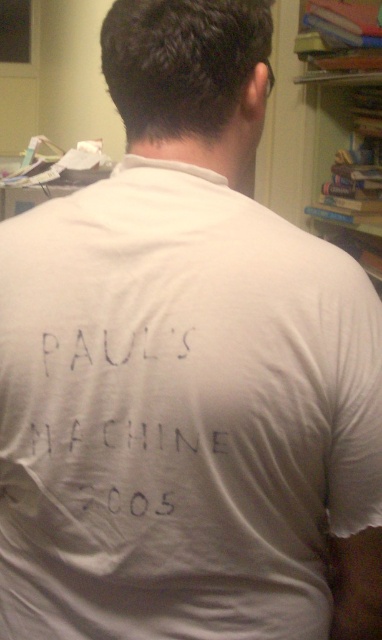
Between white fabric text at back and wooden bookshelf at upper right, which one has less height?

white fabric text at back is shorter.

From the picture: Is white fabric text at back thinner than wooden bookshelf at upper right?

Indeed, white fabric text at back has a lesser width compared to wooden bookshelf at upper right.

Does point (197, 326) come farther from viewer compared to point (354, 147)?

No, (197, 326) is in front of (354, 147).

Find the location of a particular element. Image resolution: width=382 pixels, height=640 pixels. white fabric text at back is located at coordinates (127, 419).